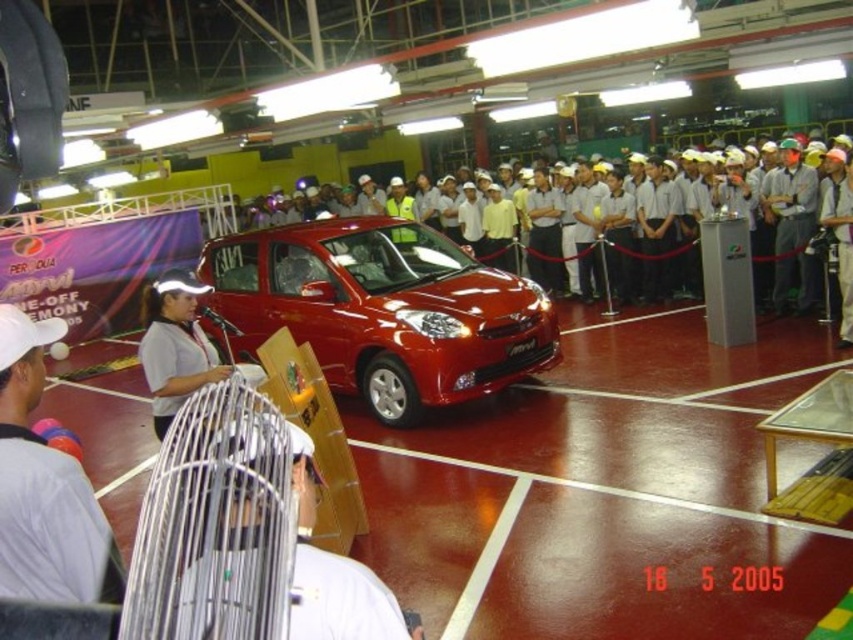
You are standing in the middle of the hall and see the white fabric fan at center and the white fabric shirt at center. Which object is nearer to you?

The white fabric fan at center is closer to the viewer than the white fabric shirt at center.

You are a photographer standing at the edge of the court. You want to capture a photo that includes both the glossy red car at center and the white fabric fan at center without any obstructions. Given that your camera has a maximum focal length that allows capturing objects up to 15 feet apart in the same frame, can you take such a photo?

The glossy red car at center and white fabric fan at center are 17.40 feet apart from each other, which exceeds the camera maximum focal length of 15 feet. Therefore, you cannot capture both in the same frame without obstructions.

You are an event planner arranging the layout for a ceremony. You need to place a podium between the glossy red car at center and the white fabric fan at center. Which object should the podium be closer to if you want it to be proportionally balanced with their sizes?

The podium should be closer to the white fabric fan at center because the glossy red car at center is larger in size, so balancing their sizes would require placing the podium nearer to the smaller object to maintain equilibrium.